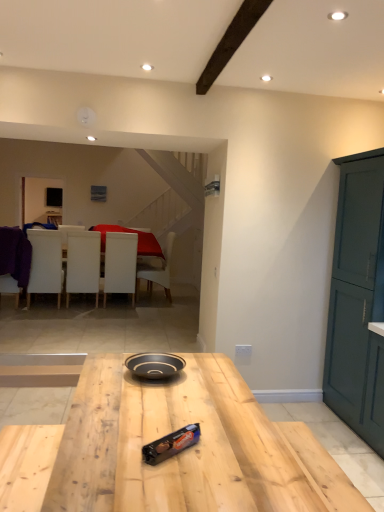
Question: Is white leather chair at center, which appears as the fifth chair when viewed from the left, shorter than natural wood table at center?

Choices:
 (A) yes
 (B) no

Answer: (B)

Question: Does white leather chair at center, the first chair positioned from the right, appear on the left side of natural wood table at center?

Choices:
 (A) no
 (B) yes

Answer: (B)

Question: Does white leather chair at center, the first chair positioned from the right, have a larger size compared to natural wood table at center?

Choices:
 (A) no
 (B) yes

Answer: (A)

Question: Is natural wood table at center located within white leather chair at center, the first chair positioned from the right?

Choices:
 (A) no
 (B) yes

Answer: (A)

Question: Is white leather chair at center, which appears as the fifth chair when viewed from the left, taller than natural wood table at center?

Choices:
 (A) yes
 (B) no

Answer: (A)

Question: Is white leather chair at center, the first chair positioned from the right, outside of natural wood table at center?

Choices:
 (A) no
 (B) yes

Answer: (B)

Question: From a real-world perspective, is white matte chair at left, the 2th chair in the left-to-right sequence, positioned over white matte chair at center, the fourth chair positioned from the left, based on gravity?

Choices:
 (A) yes
 (B) no

Answer: (A)

Question: Does white matte chair at left, the 2th chair in the left-to-right sequence, have a lesser width compared to white matte chair at center, the 2th chair from the right?

Choices:
 (A) yes
 (B) no

Answer: (B)

Question: From the image's perspective, is white matte chair at left, the 2th chair in the left-to-right sequence, under white matte chair at center, the 2th chair from the right?

Choices:
 (A) yes
 (B) no

Answer: (B)

Question: Can we say white matte chair at left, the 2th chair in the left-to-right sequence, lies outside white matte chair at center, the fourth chair positioned from the left?

Choices:
 (A) no
 (B) yes

Answer: (B)

Question: Is white matte chair at left, acting as the 4th chair starting from the right, to the right of white matte chair at center, the 2th chair from the right, from the viewer's perspective?

Choices:
 (A) no
 (B) yes

Answer: (A)

Question: From the image's perspective, would you say natural wood table at center is positioned over shiny chocolate bar at center?

Choices:
 (A) yes
 (B) no

Answer: (B)